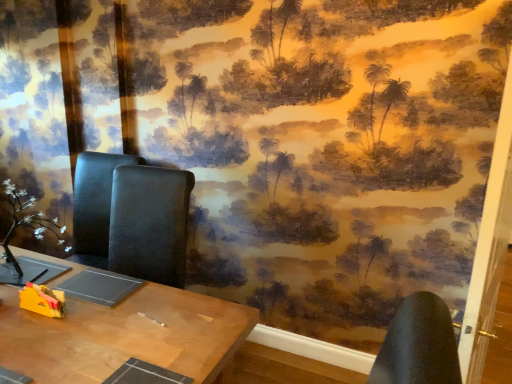
Locate an element on the screen. vacant space to the right of yellow plastic toy at lower left is located at coordinates (85, 319).